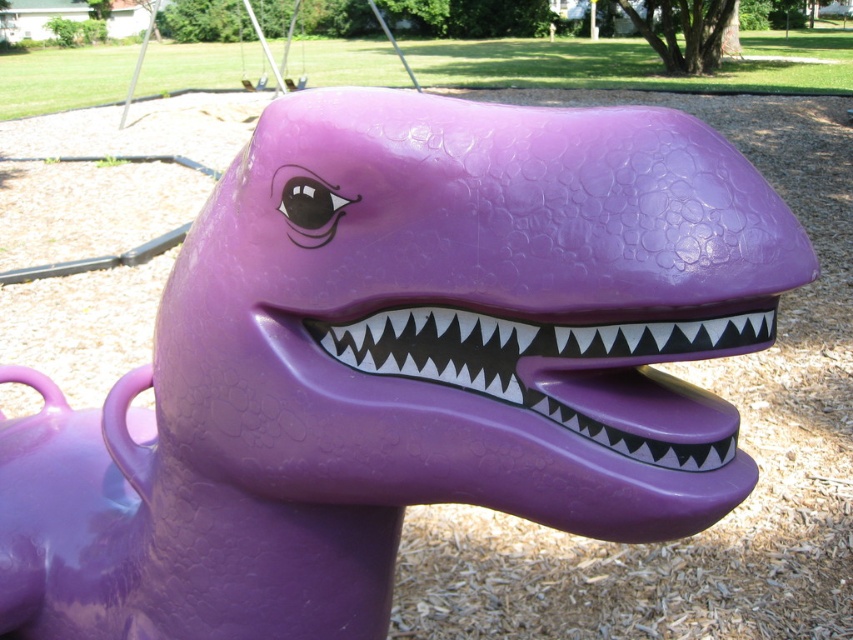
Does glossy purple mouth at center have a smaller size compared to metallic silver swing at upper center?

Yes, glossy purple mouth at center is smaller than metallic silver swing at upper center.

Between glossy purple mouth at center and metallic silver swing at upper center, which one has more height?

With more height is metallic silver swing at upper center.

Between point (718, 406) and point (297, 1), which one is positioned in front?

Point (718, 406)

Find the location of a particular element. The image size is (853, 640). glossy purple mouth at center is located at coordinates (566, 371).